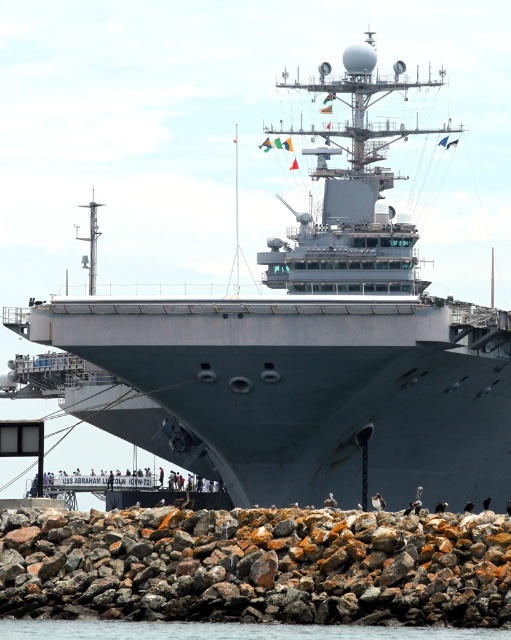
Looking at this image, you are standing on the deck of the USS Abraham Lincoln and looking out towards the port. There are two points marked on the deck, point (288, 586) and point (10, 625). Which point is closer to you?

Point (288, 586) is closer to the viewer than point (10, 625).

You are a sailor on the USS Abraham Lincoln. You notice a rusty rock at lower center and transparent water at lower center near the ship. Which object is higher in elevation?

The rusty rock at lower center is much taller than the transparent water at lower center, so the rusty rock at lower center is higher in elevation.